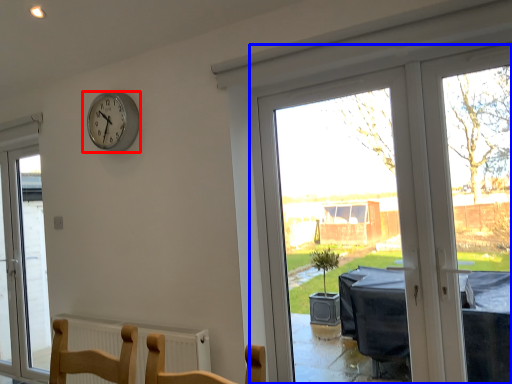
Question: Among these objects, which one is farthest to the camera, wall clock (highlighted by a red box) or window (highlighted by a blue box)?

Choices:
 (A) wall clock
 (B) window

Answer: (A)